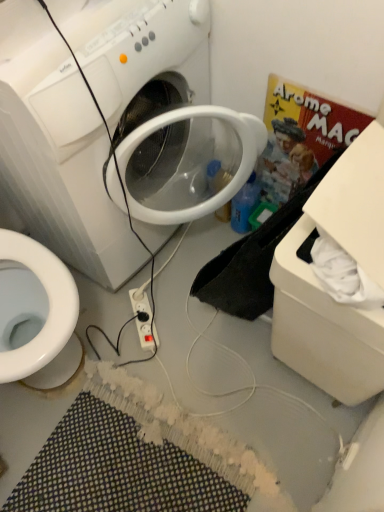
Question: Is white plastic power outlet at center positioned before blue plastic bottle at center-right?

Choices:
 (A) no
 (B) yes

Answer: (B)

Question: From the image's perspective, is white plastic power outlet at center beneath blue plastic bottle at center-right?

Choices:
 (A) yes
 (B) no

Answer: (A)

Question: Is white plastic power outlet at center not near blue plastic bottle at center-right?

Choices:
 (A) yes
 (B) no

Answer: (B)

Question: From a real-world perspective, is white plastic power outlet at center positioned under blue plastic bottle at center-right based on gravity?

Choices:
 (A) yes
 (B) no

Answer: (A)

Question: Can you confirm if white plastic power outlet at center is smaller than blue plastic bottle at center-right?

Choices:
 (A) yes
 (B) no

Answer: (A)

Question: From the image's perspective, is blue plastic bottle at center-right positioned above or below white plastic washing machine at center?

Choices:
 (A) below
 (B) above

Answer: (A)

Question: In the image, is blue plastic bottle at center-right on the left side or the right side of white plastic washing machine at center?

Choices:
 (A) left
 (B) right

Answer: (B)

Question: From a real-world perspective, is blue plastic bottle at center-right above or below white plastic washing machine at center?

Choices:
 (A) above
 (B) below

Answer: (B)

Question: In the image, is blue plastic bottle at center-right positioned in front of or behind white plastic washing machine at center?

Choices:
 (A) front
 (B) behind

Answer: (B)

Question: Choose the correct answer: Is white plastic washing machine at center inside white plastic power outlet at center or outside it?

Choices:
 (A) outside
 (B) inside

Answer: (A)

Question: Looking at the image, does white plastic washing machine at center seem bigger or smaller compared to white plastic power outlet at center?

Choices:
 (A) big
 (B) small

Answer: (A)

Question: From their relative heights in the image, would you say white plastic washing machine at center is taller or shorter than white plastic power outlet at center?

Choices:
 (A) short
 (B) tall

Answer: (B)

Question: Considering the positions of point (195, 39) and point (140, 294), is point (195, 39) closer or farther from the camera than point (140, 294)?

Choices:
 (A) closer
 (B) farther

Answer: (A)

Question: In terms of height, does multicolored woven bath mat at lower center look taller or shorter compared to blue plastic bottle at center-right?

Choices:
 (A) tall
 (B) short

Answer: (B)

Question: Is multicolored woven bath mat at lower center wider or thinner than blue plastic bottle at center-right?

Choices:
 (A) thin
 (B) wide

Answer: (B)